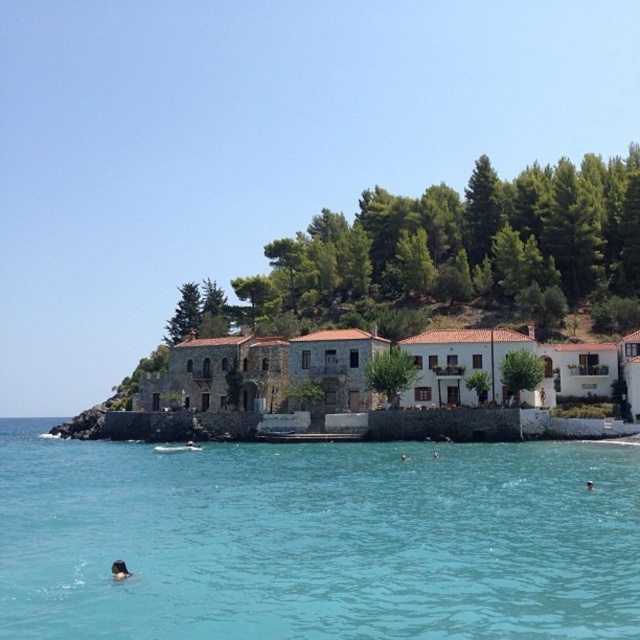
Question: Is clear blue water at lower center below brown hair at lower center?

Choices:
 (A) no
 (B) yes

Answer: (B)

Question: Can you confirm if clear blue water at lower center is bigger than black matte person at lower left?

Choices:
 (A) no
 (B) yes

Answer: (B)

Question: Among these points, which one is nearest to the camera?

Choices:
 (A) (593, 486)
 (B) (200, 476)
 (C) (122, 572)

Answer: (C)

Question: Which object is closer to the camera taking this photo?

Choices:
 (A) black matte person at lower left
 (B) clear blue water at lower center

Answer: (B)

Question: Is black matte person at lower left smaller than brown hair at lower center?

Choices:
 (A) yes
 (B) no

Answer: (B)

Question: Which point is farther from the camera taking this photo?

Choices:
 (A) (356, 595)
 (B) (115, 563)

Answer: (B)